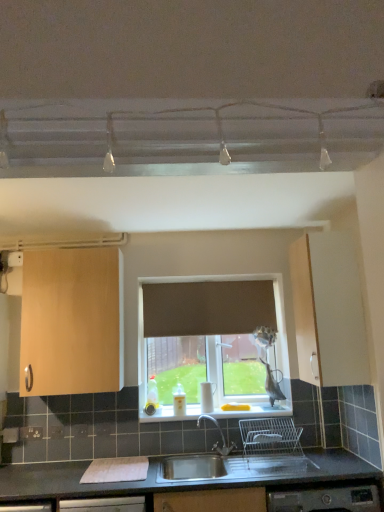
Question: Could white plastic electric outlet at lower left be considered to be inside stainless steel sink at lower center?

Choices:
 (A) yes
 (B) no

Answer: (B)

Question: Is stainless steel sink at lower center taller than white plastic electric outlet at lower left?

Choices:
 (A) yes
 (B) no

Answer: (A)

Question: Considering the relative sizes of stainless steel sink at lower center and white plastic electric outlet at lower left in the image provided, is stainless steel sink at lower center thinner than white plastic electric outlet at lower left?

Choices:
 (A) yes
 (B) no

Answer: (B)

Question: From the image's perspective, is stainless steel sink at lower center over white plastic electric outlet at lower left?

Choices:
 (A) no
 (B) yes

Answer: (A)

Question: From a real-world perspective, is stainless steel sink at lower center located beneath white plastic electric outlet at lower left?

Choices:
 (A) no
 (B) yes

Answer: (B)

Question: Is white plastic electric outlet at lower left in front of or behind brown fabric curtain at center in the image?

Choices:
 (A) behind
 (B) front

Answer: (B)

Question: Looking at their shapes, would you say white plastic electric outlet at lower left is wider or thinner than brown fabric curtain at center?

Choices:
 (A) wide
 (B) thin

Answer: (B)

Question: Considering the positions of point click(39, 435) and point click(268, 320), is point click(39, 435) closer or farther from the camera than point click(268, 320)?

Choices:
 (A) closer
 (B) farther

Answer: (A)

Question: From a real-world perspective, is white plastic electric outlet at lower left above or below brown fabric curtain at center?

Choices:
 (A) above
 (B) below

Answer: (B)

Question: From the image's perspective, is stainless steel sink at lower center located above or below matte wood cabinet at right, the 2th cabinetry viewed from the left?

Choices:
 (A) above
 (B) below

Answer: (B)

Question: Considering their positions, is stainless steel sink at lower center located in front of or behind matte wood cabinet at right, which appears as the first cabinetry when viewed from the right?

Choices:
 (A) front
 (B) behind

Answer: (A)

Question: Looking at their shapes, would you say stainless steel sink at lower center is wider or thinner than matte wood cabinet at right, the 2th cabinetry viewed from the left?

Choices:
 (A) wide
 (B) thin

Answer: (A)

Question: Is point (274, 471) closer or farther from the camera than point (347, 315)?

Choices:
 (A) farther
 (B) closer

Answer: (B)

Question: Is white plastic electric outlet at lower left inside the boundaries of white glossy window sill at center, or outside?

Choices:
 (A) outside
 (B) inside

Answer: (A)

Question: Considering the positions of point (31, 438) and point (170, 415), is point (31, 438) closer or farther from the camera than point (170, 415)?

Choices:
 (A) closer
 (B) farther

Answer: (A)